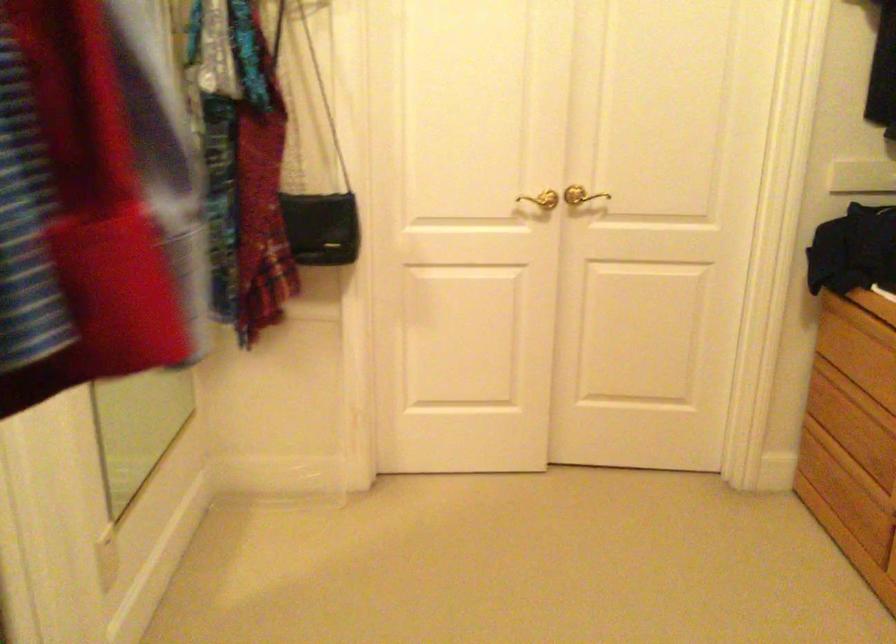
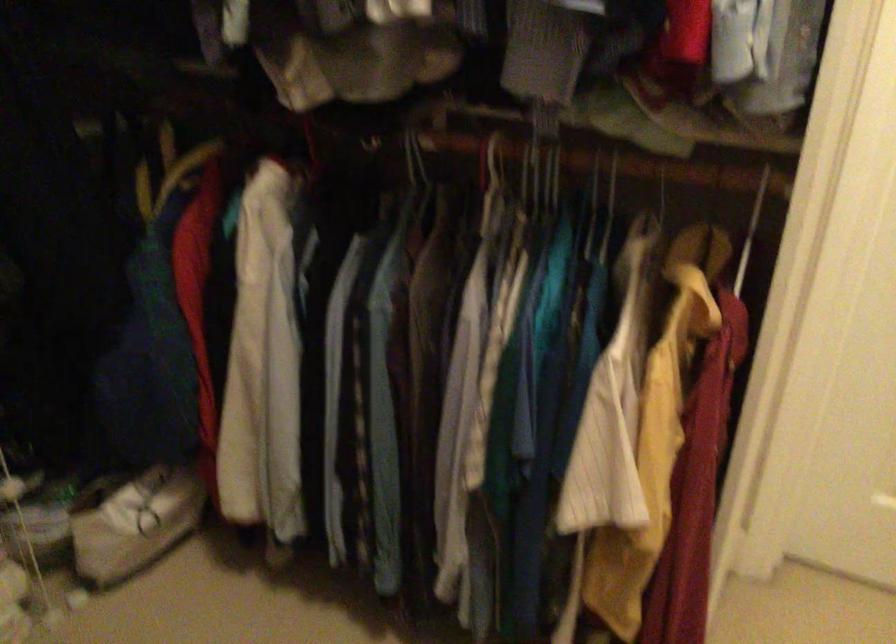
Based on the continuous images, in which direction is the camera rotating?

The rotation direction of the camera is left-down.